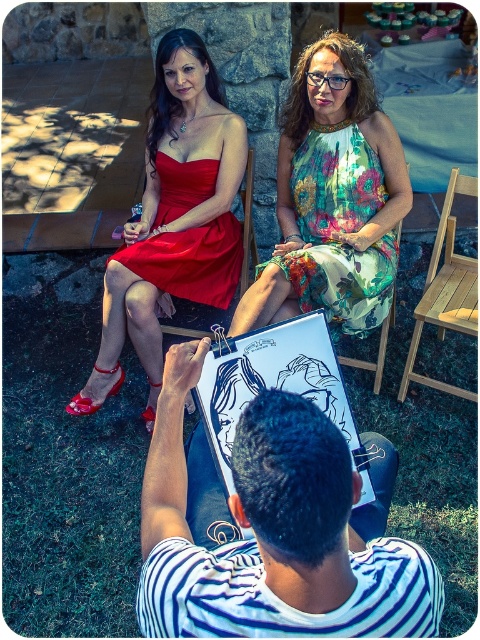
Who is taller, matte red dress at upper left or wooden chair at center?

wooden chair at center is taller.

Is matte red dress at upper left to the left of wooden chair at center from the viewer's perspective?

Yes, matte red dress at upper left is to the left of wooden chair at center.

Find the location of a particular element. matte red dress at upper left is located at coordinates (190, 260).

Can you confirm if striped cotton shirt at center is positioned to the right of matte red dress at upper left?

Yes, striped cotton shirt at center is to the right of matte red dress at upper left.

Who is shorter, striped cotton shirt at center or matte red dress at upper left?

striped cotton shirt at center

Describe the element at coordinates (276, 531) in the screenshot. I see `striped cotton shirt at center` at that location.

Image resolution: width=480 pixels, height=640 pixels. Identify the location of striped cotton shirt at center. (276, 531).

Is matte satin dress at upper left wider than matte red dress at upper left?

Yes, matte satin dress at upper left is wider than matte red dress at upper left.

Does matte satin dress at upper left have a lesser width compared to matte red dress at upper left?

No.

Does point (170, 99) come behind point (175, 198)?

No, it is not.

What are the coordinates of `matte satin dress at upper left` in the screenshot? It's located at (172, 220).